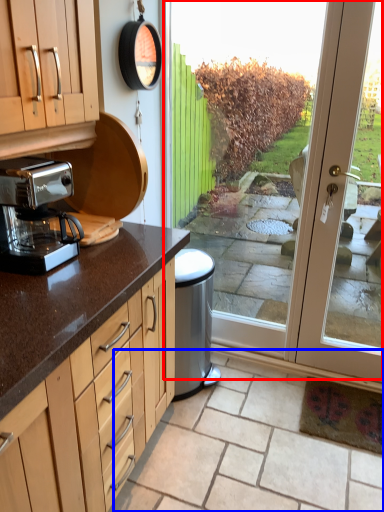
Question: Among these objects, which one is nearest to the camera, screen door (highlighted by a red box) or tile (highlighted by a blue box)?

Choices:
 (A) screen door
 (B) tile

Answer: (B)